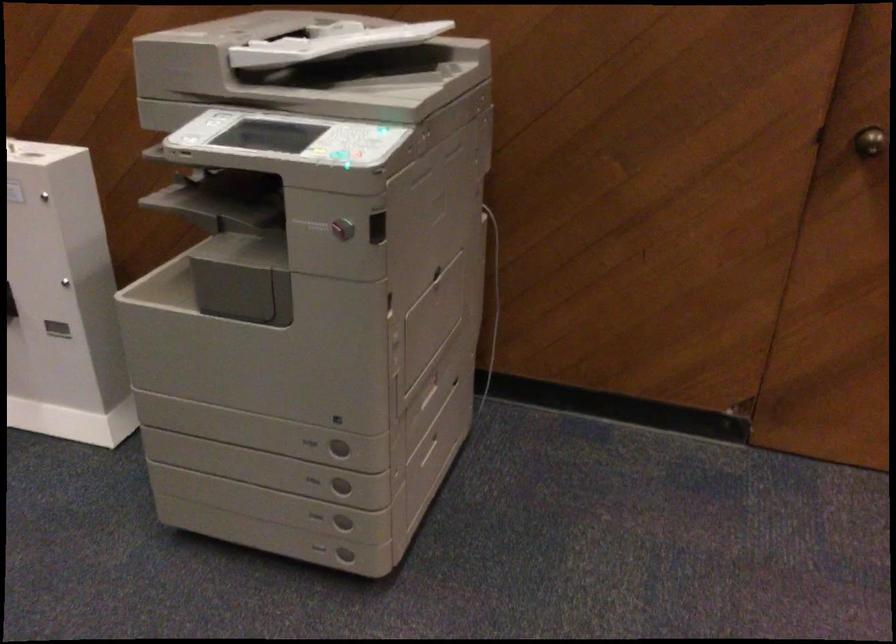
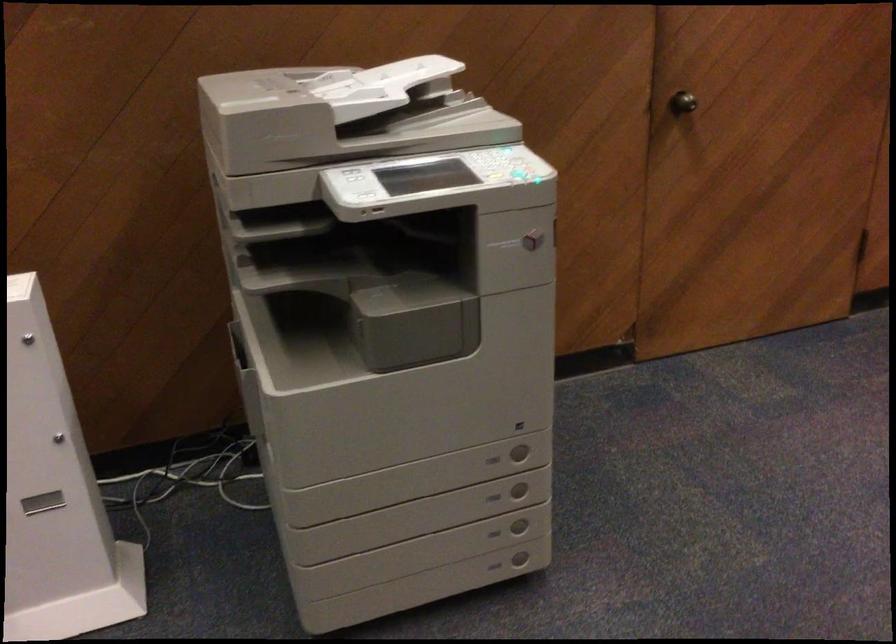
Find the pixel in the second image that matches [340,558] in the first image.

(520, 559)